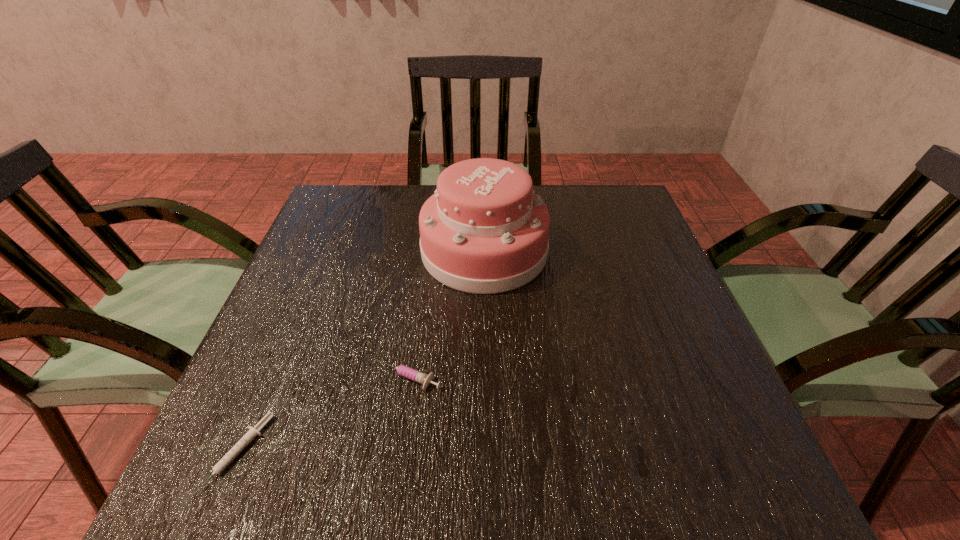
Choose which object is the nearest neighbor to the shorter syringe. Please provide its 2D coordinates. Your answer should be formatted as a tuple, i.e. [(x, y)], where the tuple contains the x and y coordinates of a point satisfying the conditions above.

[(402, 370)]

Identify the location of vacant region that satisfies the following two spatial constraints: 1. on the back side of the right syringe; 2. on the left side of the birthday cake. Image resolution: width=960 pixels, height=540 pixels. (425, 251).

Locate an element on the screen. free space that satisfies the following two spatial constraints: 1. on the back side of the nearer syringe; 2. on the right side of the birthday cake is located at coordinates click(x=324, y=251).

Locate an element on the screen. The image size is (960, 540). free point that satisfies the following two spatial constraints: 1. on the back side of the second shortest object; 2. on the left side of the tallest object is located at coordinates (425, 251).

Find the location of `vacant area that satisfies the following two spatial constraints: 1. on the back side of the second nearest object; 2. on the left side of the nearest object`. vacant area that satisfies the following two spatial constraints: 1. on the back side of the second nearest object; 2. on the left side of the nearest object is located at coordinates (271, 377).

Locate an element on the screen. This screenshot has width=960, height=540. free space that satisfies the following two spatial constraints: 1. on the back side of the taller syringe; 2. on the left side of the shorter syringe is located at coordinates (271, 377).